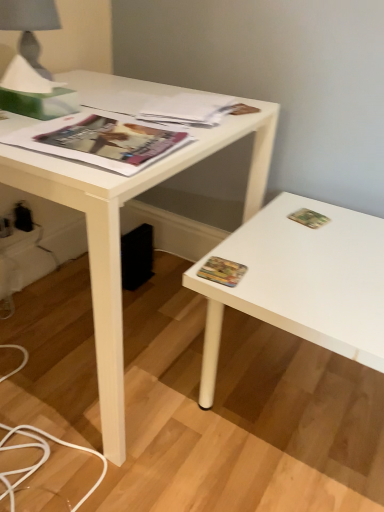
Question: From their relative heights in the image, would you say multicolored paper at right, the 1th paperback book when ordered from left to right, is taller or shorter than matte paper magazine at upper center, the second magazine from the front?

Choices:
 (A) short
 (B) tall

Answer: (A)

Question: From the image's perspective, is multicolored paper at right, which ranks as the 2th paperback book in top-to-bottom order, above or below matte paper magazine at upper center, the second magazine from the front?

Choices:
 (A) above
 (B) below

Answer: (B)

Question: Which is nearer to the matte paper magazine at upper left, positioned as the first magazine in front-to-back order?

Choices:
 (A) white plastic electric outlet at lower left, arranged as the second electric outlet when viewed from the back
 (B) white matte desk at center
 (C) matte gray fabric at upper left
 (D) green matte paperback book at upper right, placed as the first paperback book when sorted from back to front
 (E) black plastic electric outlet at lower left, the 2th electric outlet viewed from the front

Answer: (B)

Question: Which object is the farthest from the white plastic electric outlet at lower left, arranged as the second electric outlet when viewed from the back?

Choices:
 (A) white matte desk at center
 (B) multicolored paper at right, the 1th paperback book when ordered from left to right
 (C) green matte paperback book at upper right, which is counted as the second paperback book, starting from the bottom
 (D) matte paper magazine at upper left, positioned as the first magazine in front-to-back order
 (E) matte gray fabric at upper left

Answer: (C)